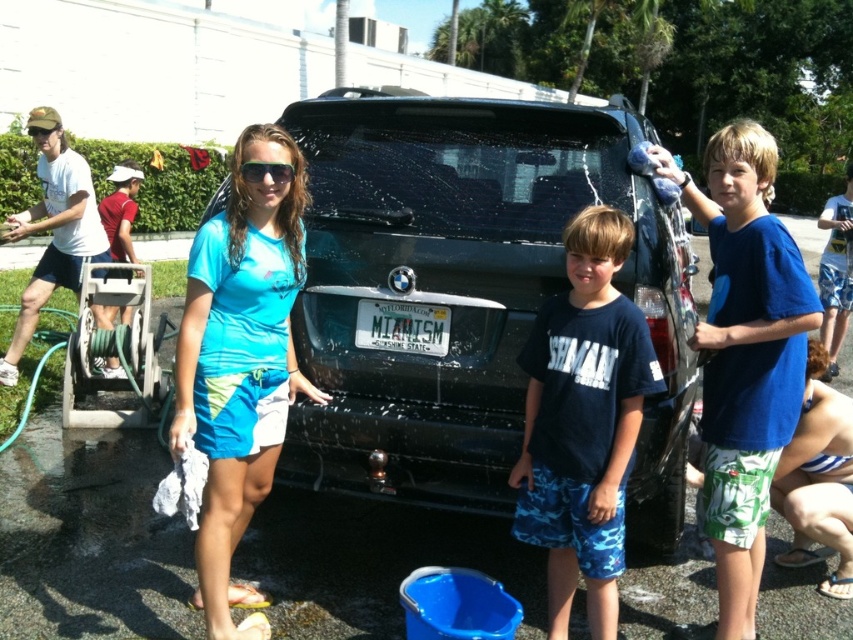
Question: Which object is positioned closest to the blue fabric shirt at center?

Choices:
 (A) blue cotton shirt at center
 (B) green matte goggles at upper center
 (C) red fabric hose at left

Answer: (A)

Question: Can you confirm if glossy black suv at center is positioned above blue cotton shirt at center?

Choices:
 (A) no
 (B) yes

Answer: (A)

Question: Considering the relative positions of blue fabric shirt at center and blue camouflage shorts at center in the image provided, where is blue fabric shirt at center located with respect to blue camouflage shorts at center?

Choices:
 (A) left
 (B) right

Answer: (A)

Question: Among these objects, which one is nearest to the camera?

Choices:
 (A) green matte goggles at upper center
 (B) blue printed shorts at center
 (C) red fabric hose at left
 (D) blue cotton shirt at center

Answer: (D)

Question: Is blue cotton shirt at center thinner than blue camouflage shorts at center?

Choices:
 (A) yes
 (B) no

Answer: (B)

Question: Among these points, which one is nearest to the camera?

Choices:
 (A) (850, 170)
 (B) (131, 205)
 (C) (35, 134)

Answer: (C)